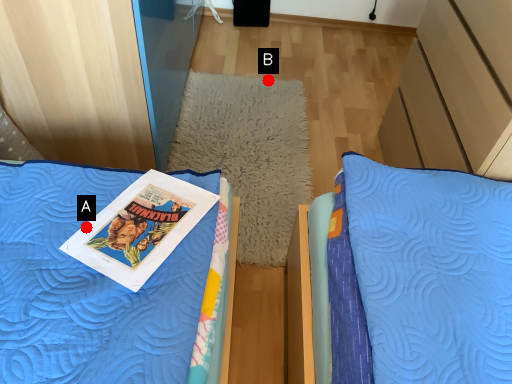
Question: Two points are circled on the image, labeled by A and B beside each circle. Among these points, which one is nearest to the camera?

Choices:
 (A) A is closer
 (B) B is closer

Answer: (A)